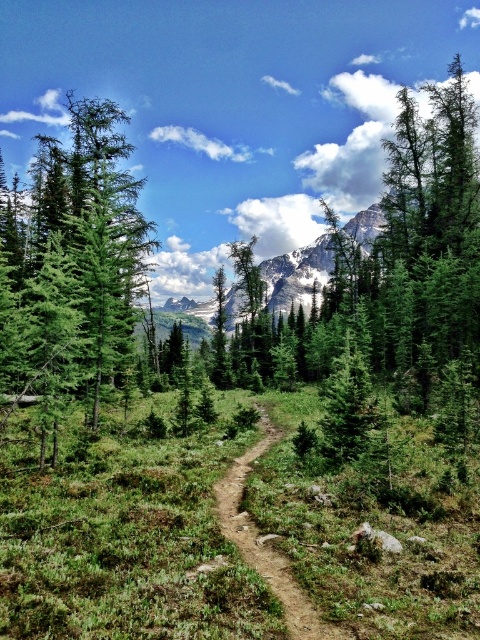
You are a hiker standing on the narrow dirt trail in the meadow. You see two points marked on the map as point 1 at coordinates [90,424] and point 2 at coordinates [226,493]. Which point is closer to you?

Point 1 at coordinates [90,424] is closer to you because it is further to the viewer than point 2 at coordinates [226,493].

You are a hiker planning to walk along the brown dirt track at center. There is a green matte tree at left nearby. Will the tree block your path?

The green matte tree at left is positioned over the brown dirt track at center, so it will block your path.